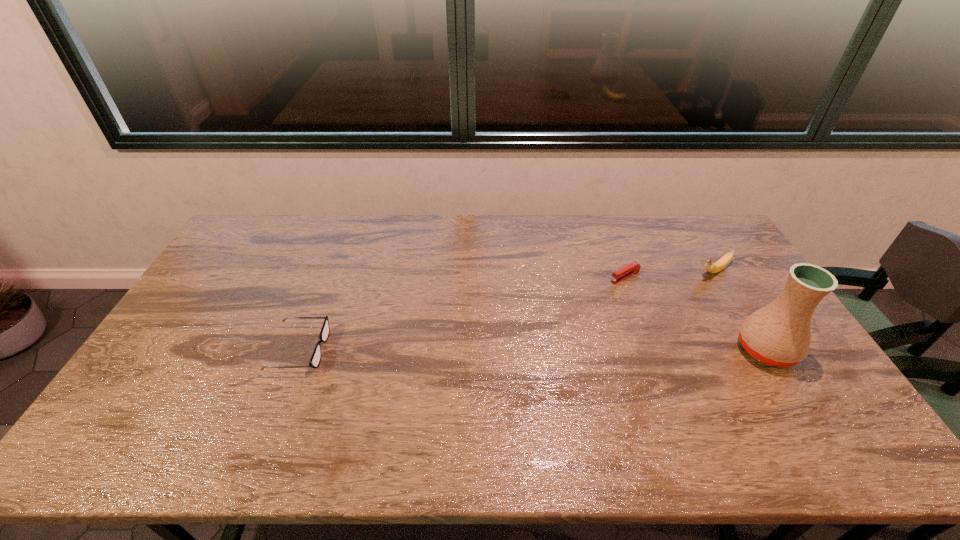
In order to click on spectacles in this screenshot , I will do `click(314, 362)`.

Locate an element on the screen. The height and width of the screenshot is (540, 960). pottery is located at coordinates (778, 334).

I want to click on stapler, so click(x=629, y=270).

Image resolution: width=960 pixels, height=540 pixels. Find the location of `banana`. banana is located at coordinates (711, 267).

In order to click on free space located on the front-facing side of the leftmost object in this screenshot , I will do `click(414, 349)`.

Where is `blank area located on the left of the tallest object`? blank area located on the left of the tallest object is located at coordinates (623, 349).

Identify the location of vacant region located on the front-facing side of the stapler. This screenshot has width=960, height=540. (586, 295).

The width and height of the screenshot is (960, 540). Find the location of `free point located 0.130m on the front-facing side of the stapler`. free point located 0.130m on the front-facing side of the stapler is located at coordinates (584, 296).

This screenshot has width=960, height=540. I want to click on vacant space located on the front-facing side of the stapler, so click(547, 314).

Image resolution: width=960 pixels, height=540 pixels. Find the location of `vacant space located 0.360m at the stem of the banana`. vacant space located 0.360m at the stem of the banana is located at coordinates (628, 324).